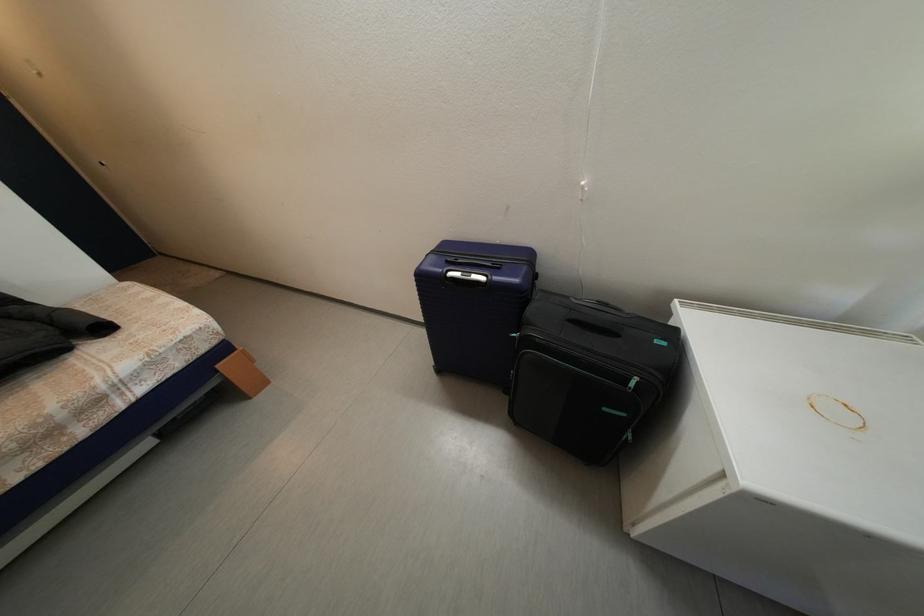
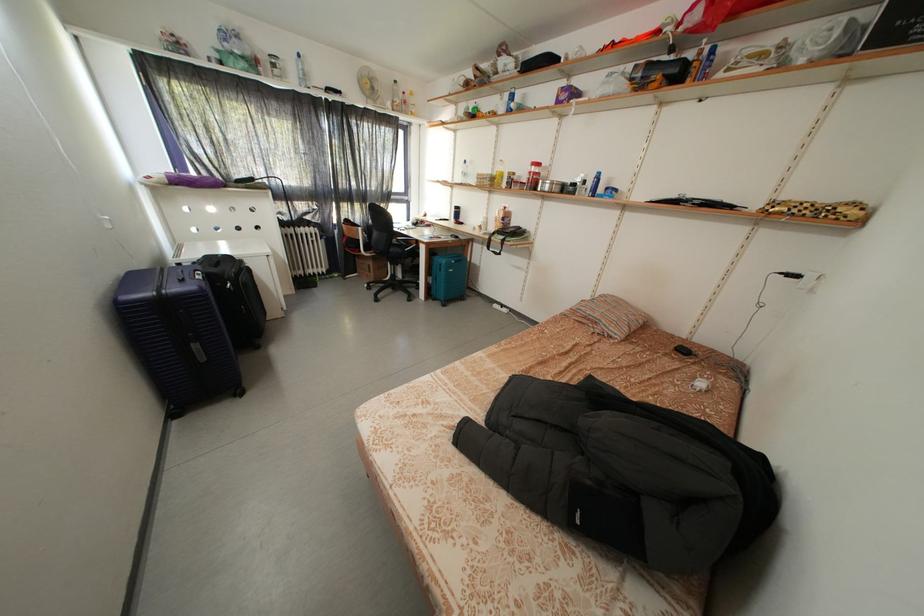
The point at (482, 282) is marked in the first image. Where is the corresponding point in the second image?

(208, 280)